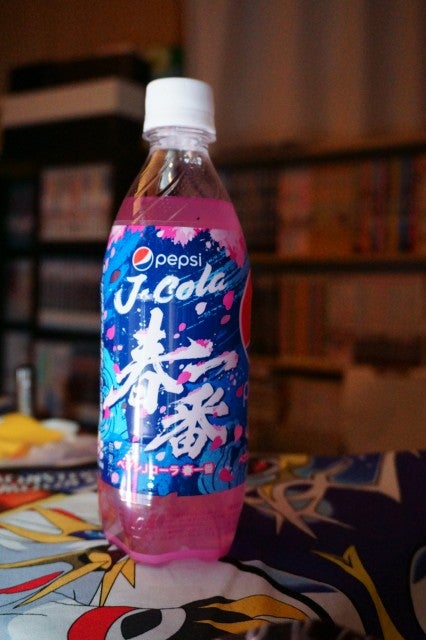
Identify the location of bottle. (200, 384).